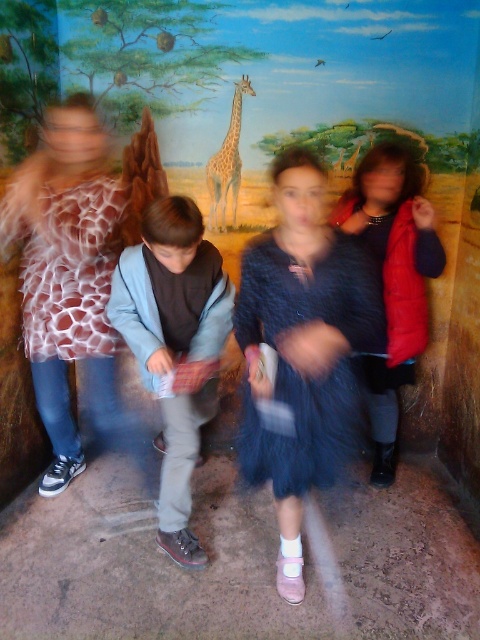
You are a photographer setting up for a group photo. You have a camera with a lens that has a maximum focus range of 28 inches. You need to ensure that both the velvet blue dress at center and the velvet red vest at right are in focus. Can you capture both in focus with this camera setting?

The velvet blue dress at center and the velvet red vest at right are 27.90 inches apart from each other, which is within the camera lens maximum focus range of 28 inches. Therefore, both can be captured in focus.

You are a photographer setting up for a group photo. You have a camera with a lens that can focus on objects up to 30 inches apart. The scene includes a velvet red vest at right and a spotted fur giraffe at center. Can both subjects be in focus at the same time?

The velvet red vest at right and spotted fur giraffe at center are 30.15 inches apart from each other. Since the camera can focus on objects up to 30 inches apart, the distance between them exceeds the maximum focus range. Therefore, both subjects cannot be in focus simultaneously.

You are organizing a costume party and need to arrange two outfits based on their length. You have the velvet blue dress at center and the velvet red vest at right. Which outfit should you place on the higher shelf if the shelves are arranged so that shorter items go on lower shelves and taller items on higher ones?

The velvet red vest at right should be placed on the higher shelf because it is taller than the velvet blue dress at center, which is shorter and belongs on a lower shelf.